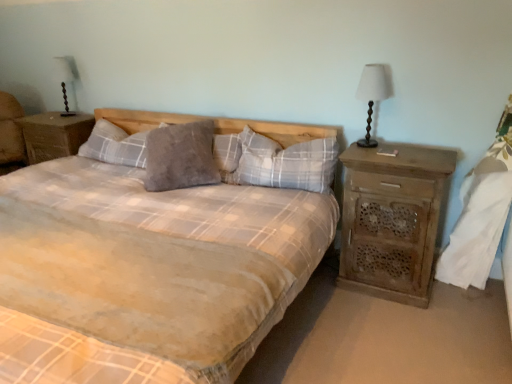
What do you see at coordinates (392, 220) in the screenshot? This screenshot has height=384, width=512. I see `rustic wood nightstand at right, acting as the second nightstand starting from the left` at bounding box center [392, 220].

At what (x,y) coordinates should I click in order to perform the action: click on matte wood lamp at right. Please return your answer as a coordinate pair (x, y). This screenshot has width=512, height=384. Looking at the image, I should click on (373, 94).

What do you see at coordinates (146, 273) in the screenshot? I see `plaid fabric bed at center` at bounding box center [146, 273].

Locate an element on the screen. matte black table lamp at upper left is located at coordinates (65, 76).

What is the approximate height of matte black table lamp at upper left?

matte black table lamp at upper left is 17.09 inches tall.

This screenshot has width=512, height=384. Identify the location of wooden nightstand at left, which is counted as the second nightstand, starting from the front. (54, 135).

From the image's perspective, is rustic wood nightstand at right, the 2th nightstand when ordered from top to bottom, located beneath grey fuzzy pillow at center, which ranks as the 2th pillow in right-to-left order?

Indeed, from the image's perspective, rustic wood nightstand at right, the 2th nightstand when ordered from top to bottom, is shown beneath grey fuzzy pillow at center, which ranks as the 2th pillow in right-to-left order.

Based on the photo, considering the relative positions of rustic wood nightstand at right, the 2th nightstand when ordered from top to bottom, and grey fuzzy pillow at center, which ranks as the 2th pillow in right-to-left order, in the image provided, is rustic wood nightstand at right, the 2th nightstand when ordered from top to bottom, to the left or to the right of grey fuzzy pillow at center, which ranks as the 2th pillow in right-to-left order,?

In the image, rustic wood nightstand at right, the 2th nightstand when ordered from top to bottom, appears on the right side of grey fuzzy pillow at center, which ranks as the 2th pillow in right-to-left order.

Is rustic wood nightstand at right, positioned as the first nightstand in front-to-back order, not inside grey fuzzy pillow at center, which ranks as the 2th pillow in right-to-left order?

Yes, rustic wood nightstand at right, positioned as the first nightstand in front-to-back order, is outside of grey fuzzy pillow at center, which ranks as the 2th pillow in right-to-left order.

Is grey fuzzy pillow at center, which ranks as the 2th pillow in right-to-left order, at the back of rustic wood nightstand at right, acting as the first nightstand starting from the bottom?

No.

From the plush gray pillow at center, placed as the third pillow when sorted from right to left, count 2nd pillow to the right and point to it. Please provide its 2D coordinates.

[(285, 163)]

Is point (125, 157) closer or farther from the camera than point (270, 161)?

Point (125, 157) appears to be farther away from the viewer than point (270, 161).

Could you tell me if plush gray pillow at center, placed as the third pillow when sorted from right to left, is turned towards gray soft pillow at center, which ranks as the 3th pillow in left-to-right order?

No, plush gray pillow at center, placed as the third pillow when sorted from right to left, does not turn towards gray soft pillow at center, which ranks as the 3th pillow in left-to-right order.

Considering the positions of points (497, 222) and (252, 131), is point (497, 222) closer to camera compared to point (252, 131)?

Yes, it is.

Looking at this image, is white fabric at right looking in the opposite direction of gray soft pillow at center, placed as the first pillow when sorted from right to left?

No, gray soft pillow at center, placed as the first pillow when sorted from right to left, is not at the back of white fabric at right.

Which object is positioned more to the right, white fabric at right or gray soft pillow at center, placed as the first pillow when sorted from right to left?

white fabric at right.

Is white fabric at right situated inside gray soft pillow at center, placed as the first pillow when sorted from right to left, or outside?

white fabric at right is located beyond the bounds of gray soft pillow at center, placed as the first pillow when sorted from right to left.

Is gray soft pillow at center, placed as the first pillow when sorted from right to left, bigger or smaller than plush gray pillow at center, the first pillow when ordered from left to right?

In the image, gray soft pillow at center, placed as the first pillow when sorted from right to left, appears to be larger than plush gray pillow at center, the first pillow when ordered from left to right.

In terms of height, does gray soft pillow at center, placed as the first pillow when sorted from right to left, look taller or shorter compared to plush gray pillow at center, the first pillow when ordered from left to right?

Clearly, gray soft pillow at center, placed as the first pillow when sorted from right to left, is taller compared to plush gray pillow at center, the first pillow when ordered from left to right.

Would you say gray soft pillow at center, placed as the first pillow when sorted from right to left, contains plush gray pillow at center, the first pillow when ordered from left to right?

Definitely not — plush gray pillow at center, the first pillow when ordered from left to right, is not inside gray soft pillow at center, placed as the first pillow when sorted from right to left.

From a real-world perspective, which object stands above the other?

gray soft pillow at center, placed as the first pillow when sorted from right to left, is physically above.

Considering the relative positions of plush gray pillow at center, the first pillow when ordered from left to right, and rustic wood nightstand at right, the 2th nightstand viewed from the back, in the image provided, is plush gray pillow at center, the first pillow when ordered from left to right, to the right of rustic wood nightstand at right, the 2th nightstand viewed from the back, from the viewer's perspective?

Incorrect, plush gray pillow at center, the first pillow when ordered from left to right, is not on the right side of rustic wood nightstand at right, the 2th nightstand viewed from the back.

From the image's perspective, is plush gray pillow at center, placed as the third pillow when sorted from right to left, positioned above or below rustic wood nightstand at right, the 2th nightstand viewed from the back?

Based on their image positions, plush gray pillow at center, placed as the third pillow when sorted from right to left, is located above rustic wood nightstand at right, the 2th nightstand viewed from the back.

In terms of size, does plush gray pillow at center, placed as the third pillow when sorted from right to left, appear bigger or smaller than rustic wood nightstand at right, the 2th nightstand viewed from the back?

In the image, plush gray pillow at center, placed as the third pillow when sorted from right to left, appears to be smaller than rustic wood nightstand at right, the 2th nightstand viewed from the back.

Considering the positions of points (141, 157) and (362, 219), is point (141, 157) farther from camera compared to point (362, 219)?

Yes, it is behind point (362, 219).

Considering the sizes of objects wooden nightstand at left, which is the 2th nightstand from bottom to top, and plush gray pillow at center, placed as the third pillow when sorted from right to left, in the image provided, who is taller, wooden nightstand at left, which is the 2th nightstand from bottom to top, or plush gray pillow at center, placed as the third pillow when sorted from right to left,?

With more height is wooden nightstand at left, which is the 2th nightstand from bottom to top.

Is wooden nightstand at left, marked as the 1th nightstand in a top-to-bottom arrangement, oriented towards plush gray pillow at center, placed as the third pillow when sorted from right to left?

No, wooden nightstand at left, marked as the 1th nightstand in a top-to-bottom arrangement, is not turned towards plush gray pillow at center, placed as the third pillow when sorted from right to left.

How many degrees apart are the facing directions of wooden nightstand at left, acting as the 1th nightstand starting from the left, and plush gray pillow at center, placed as the third pillow when sorted from right to left?

The angular difference between wooden nightstand at left, acting as the 1th nightstand starting from the left, and plush gray pillow at center, placed as the third pillow when sorted from right to left, is 1.45 degrees.

Are matte wood lamp at right and plush gray pillow at center, placed as the third pillow when sorted from right to left, located far from each other?

Yes, matte wood lamp at right and plush gray pillow at center, placed as the third pillow when sorted from right to left, are quite far apart.

Considering the relative positions of matte wood lamp at right and plush gray pillow at center, the first pillow when ordered from left to right, in the image provided, is matte wood lamp at right to the right of plush gray pillow at center, the first pillow when ordered from left to right, from the viewer's perspective?

Yes.

Is matte wood lamp at right wider or thinner than plush gray pillow at center, placed as the third pillow when sorted from right to left?

Clearly, matte wood lamp at right has less width compared to plush gray pillow at center, placed as the third pillow when sorted from right to left.

Image resolution: width=512 pixels, height=384 pixels. I want to click on bedside lamp in front of the plush gray pillow at center, placed as the third pillow when sorted from right to left, so click(x=373, y=94).

At what (x,y) coordinates should I click in order to perform the action: click on the 2nd pillow behind the rustic wood nightstand at right, acting as the second nightstand starting from the left, starting your count from the anchor. Please return your answer as a coordinate pair (x, y). Looking at the image, I should click on (181, 157).

From a real-world perspective, count 2nd pillows upward from the plush gray pillow at center, the first pillow when ordered from left to right, and point to it. Please provide its 2D coordinates.

[(285, 163)]

In the scene shown: Estimate the real-world distances between objects in this image. Which object is further from plush gray pillow at center, placed as the third pillow when sorted from right to left, gray soft pillow at center, which ranks as the 3th pillow in left-to-right order, or rustic wood nightstand at right, the 2th nightstand viewed from the back?

rustic wood nightstand at right, the 2th nightstand viewed from the back, lies further to plush gray pillow at center, placed as the third pillow when sorted from right to left, than the other object.

Which object lies further to the anchor point wooden nightstand at left, marked as the 1th nightstand in a top-to-bottom arrangement, plush gray pillow at center, the first pillow when ordered from left to right, or matte wood lamp at right?

Among the two, matte wood lamp at right is located further to wooden nightstand at left, marked as the 1th nightstand in a top-to-bottom arrangement.

From the picture: When comparing their distances from matte black table lamp at upper left, does grey fuzzy pillow at center, which ranks as the 2th pillow in right-to-left order, or plush gray pillow at center, placed as the third pillow when sorted from right to left, seem further?

The object further to matte black table lamp at upper left is grey fuzzy pillow at center, which ranks as the 2th pillow in right-to-left order.

Which object lies nearer to the anchor point plaid fabric bed at center, rustic wood nightstand at right, the 2th nightstand when ordered from top to bottom, or matte wood lamp at right?

rustic wood nightstand at right, the 2th nightstand when ordered from top to bottom, lies closer to plaid fabric bed at center than the other object.

Based on their spatial positions, is white fabric at right or plaid fabric bed at center further from gray soft pillow at center, placed as the first pillow when sorted from right to left?

white fabric at right is positioned further to the anchor gray soft pillow at center, placed as the first pillow when sorted from right to left.

From the image, which object appears to be nearer to grey fuzzy pillow at center, arranged as the second pillow when viewed from the left, wooden nightstand at left, which is counted as the second nightstand, starting from the front, or white fabric at right?

wooden nightstand at left, which is counted as the second nightstand, starting from the front.

Based on their spatial positions, is white fabric at right or wooden nightstand at left, which is counted as the second nightstand, starting from the front, further from matte black table lamp at upper left?

white fabric at right is further to matte black table lamp at upper left.

When comparing their distances from white fabric at right, does wooden nightstand at left, marked as the 2th nightstand in a right-to-left arrangement, or rustic wood nightstand at right, positioned as the first nightstand in front-to-back order, seem closer?

The object closer to white fabric at right is rustic wood nightstand at right, positioned as the first nightstand in front-to-back order.

The width and height of the screenshot is (512, 384). I want to click on bed between wooden nightstand at left, marked as the 1th nightstand in a top-to-bottom arrangement, and white fabric at right from left to right, so click(x=146, y=273).

Where is `nightstand between gray soft pillow at center, placed as the first pillow when sorted from right to left, and white fabric at right`? nightstand between gray soft pillow at center, placed as the first pillow when sorted from right to left, and white fabric at right is located at coordinates (392, 220).

The width and height of the screenshot is (512, 384). I want to click on nightstand between plaid fabric bed at center and wooden nightstand at left, marked as the 2th nightstand in a right-to-left arrangement, in the front-back direction, so click(392, 220).

At what (x,y) coordinates should I click in order to perform the action: click on bedside lamp between gray soft pillow at center, placed as the first pillow when sorted from right to left, and white fabric at right. Please return your answer as a coordinate pair (x, y). Looking at the image, I should click on (373, 94).